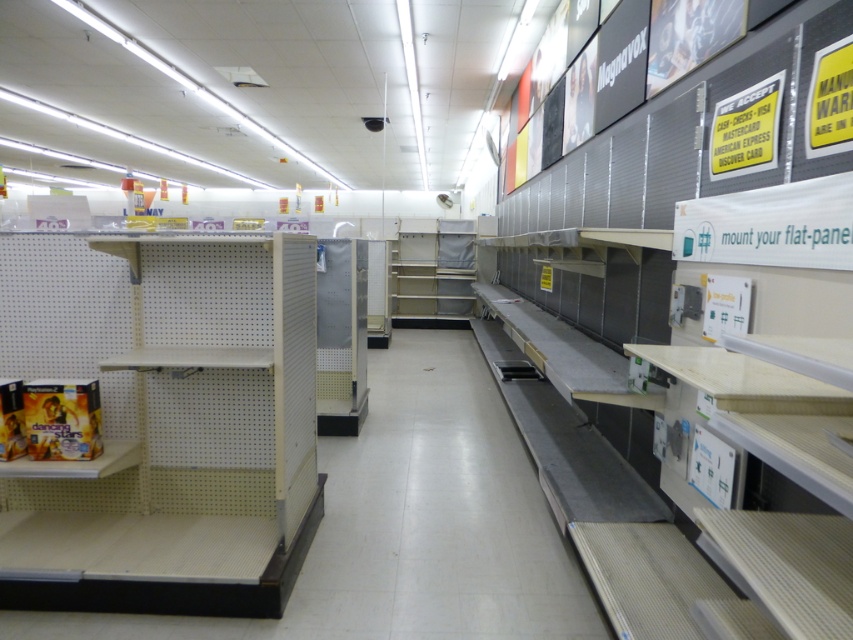
You are a store employee who needs to place a new product display between the white matte shelf at left and the metallic silver shelf at center. Based on their positions, which shelf should the display be closer to and why?

The display should be placed closer to the white matte shelf at left because it is in front of the metallic silver shelf at center, making it the more accessible and visible option for customers.